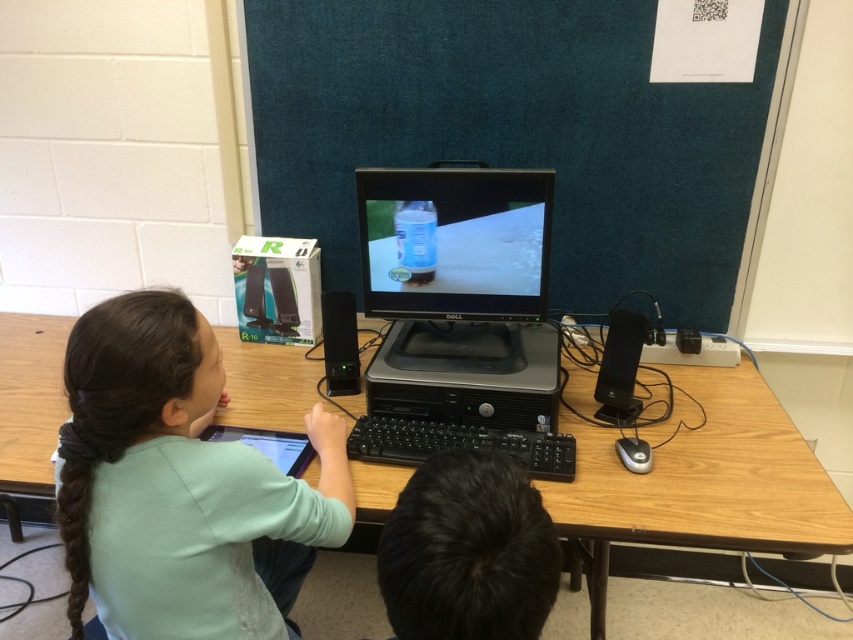
You are a teacher observing the classroom scene. You notice the black hair at center and the matte black monitor at center. Which object is positioned closer to the front of the classroom?

The black hair at center is closer to the viewer than the matte black monitor at center, so the black hair at center is positioned closer to the front of the classroom.

You are a student trying to reach the monitor to adjust the brightness. Considering the wooden table at center and the matte black monitor at center, which object is closer to you?

The wooden table at center is closer to you because it is in front of the matte black monitor at center.

You are a teacher observing a student in a classroom. The student has black hair at center and is sitting in front of a matte black monitor at center. The monitor is displaying a bottle on a table. If the student accidentally knocks over the bottle on the monitor, will it fall onto the student or the monitor?

The bottle on the monitor would fall off the monitor, but since the student is at a distance of 28.38 inches away from the matte black monitor at center, it would not land on the student or the monitor itself. It would likely fall onto the table surface below the monitor.